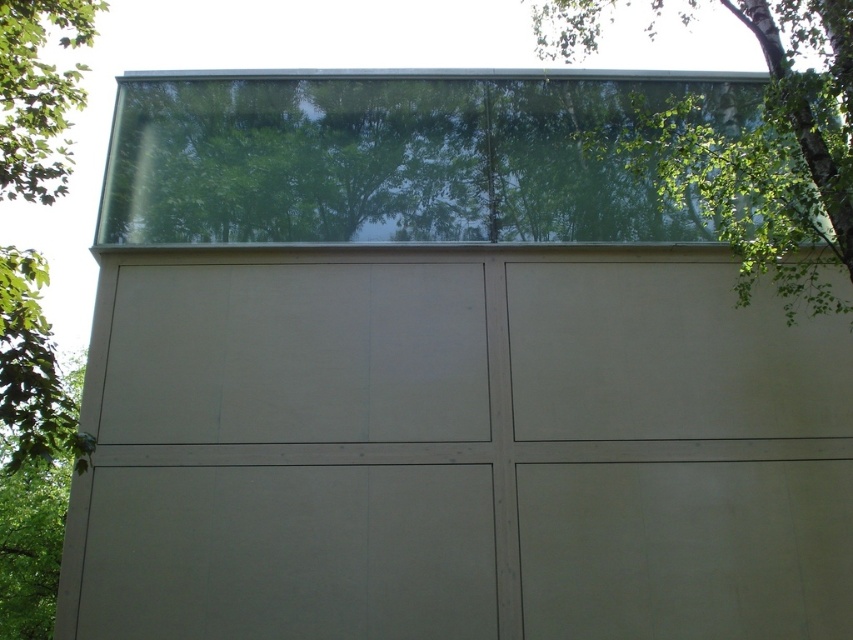
Which is more to the right, transparent glass window at upper center or green leafy tree at left?

From the viewer's perspective, transparent glass window at upper center appears more on the right side.

The height and width of the screenshot is (640, 853). What do you see at coordinates (399, 156) in the screenshot?
I see `transparent glass window at upper center` at bounding box center [399, 156].

Is point (206, 218) farther from viewer compared to point (51, 372)?

That is True.

This screenshot has width=853, height=640. What are the coordinates of `transparent glass window at upper center` in the screenshot? It's located at (399, 156).

Can you confirm if green leafy tree at upper right is smaller than green leafy tree at left?

No.

Does point (695, 173) come in front of point (61, 100)?

No, it is behind (61, 100).

What do you see at coordinates (770, 156) in the screenshot? The width and height of the screenshot is (853, 640). I see `green leafy tree at upper right` at bounding box center [770, 156].

The image size is (853, 640). What are the coordinates of `green leafy tree at upper right` in the screenshot? It's located at (770, 156).

Does matte beige garage door at center appear on the right side of transparent glass window at upper center?

Indeed, matte beige garage door at center is positioned on the right side of transparent glass window at upper center.

Is matte beige garage door at center shorter than transparent glass window at upper center?

No, matte beige garage door at center is not shorter than transparent glass window at upper center.

Is point (753, 628) closer to viewer compared to point (189, 93)?

Yes, point (753, 628) is closer to viewer.

At what (x,y) coordinates should I click in order to perform the action: click on matte beige garage door at center. Please return your answer as a coordinate pair (x, y). Image resolution: width=853 pixels, height=640 pixels. Looking at the image, I should click on (457, 452).